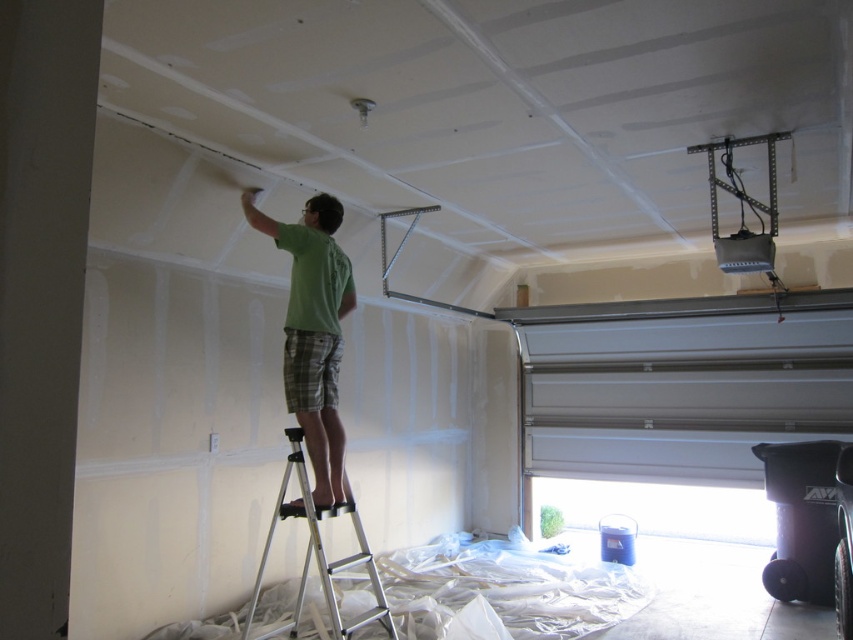
Is silver metallic garage door at lower right below silver metallic ladder at center?

No.

Is silver metallic garage door at lower right above silver metallic ladder at center?

Yes, silver metallic garage door at lower right is above silver metallic ladder at center.

Which is in front, point (660, 348) or point (334, 611)?

Positioned in front is point (334, 611).

At what (x,y) coordinates should I click in order to perform the action: click on silver metallic garage door at lower right. Please return your answer as a coordinate pair (x, y). Looking at the image, I should click on (680, 381).

Can you confirm if green cotton shirt at upper center is shorter than silver metallic ladder at center?

No.

From the picture: Which is below, green cotton shirt at upper center or silver metallic ladder at center?

Positioned lower is silver metallic ladder at center.

This screenshot has height=640, width=853. I want to click on green cotton shirt at upper center, so click(312, 330).

From the picture: Who is more distant from viewer, [566,449] or [300,339]?

Point [566,449]

Which of these two, silver metallic garage door at lower right or green cotton shirt at upper center, stands taller?

silver metallic garage door at lower right

At what (x,y) coordinates should I click in order to perform the action: click on silver metallic garage door at lower right. Please return your answer as a coordinate pair (x, y). The height and width of the screenshot is (640, 853). Looking at the image, I should click on (680, 381).